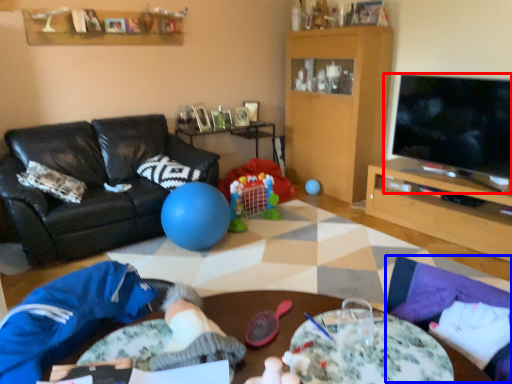
Question: Which object appears closest to the camera in this image, television (highlighted by a red box) or flat (highlighted by a blue box)?

Choices:
 (A) television
 (B) flat

Answer: (B)